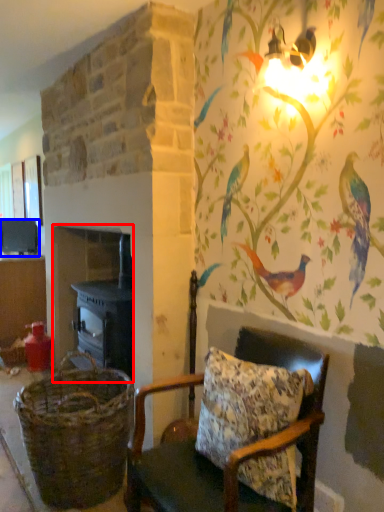
Question: Which object appears farthest to the camera in this image, fireplace (highlighted by a red box) or appliance (highlighted by a blue box)?

Choices:
 (A) fireplace
 (B) appliance

Answer: (B)